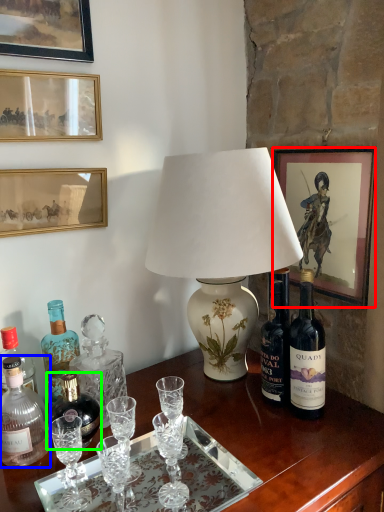
Question: Considering the real-world distances, which object is farthest from picture frame (highlighted by a red box)? bottle (highlighted by a blue box) or bottle (highlighted by a green box)?

Choices:
 (A) bottle
 (B) bottle

Answer: (A)